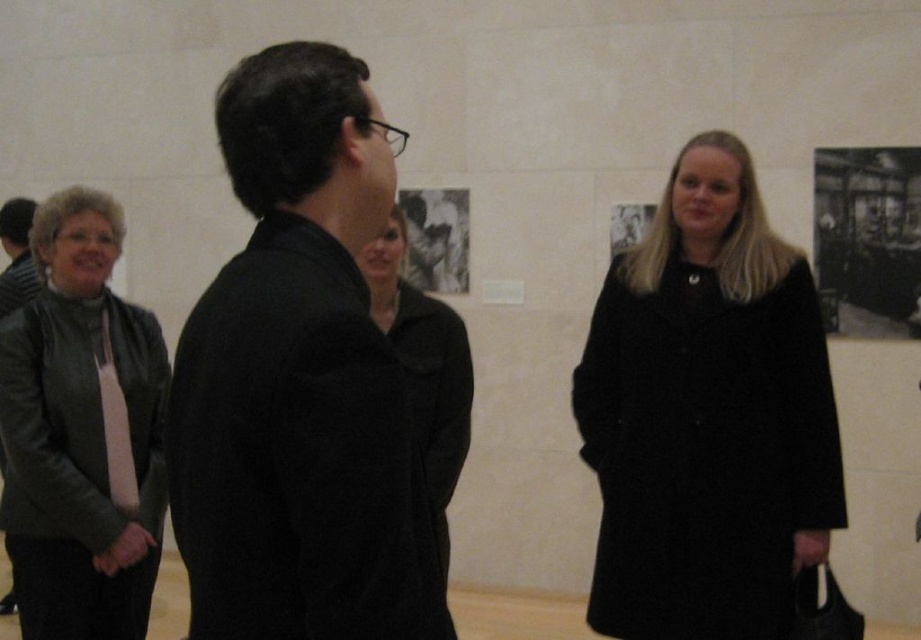
Question: Does leather jacket at left have a smaller size compared to matte black coat at center?

Choices:
 (A) yes
 (B) no

Answer: (B)

Question: Which point is closer to the camera?

Choices:
 (A) (633, 490)
 (B) (302, 392)
 (C) (102, 371)

Answer: (B)

Question: Is black wool coat at right closer to camera compared to matte black coat at center?

Choices:
 (A) no
 (B) yes

Answer: (A)

Question: Among these points, which one is farthest from the camera?

Choices:
 (A) (794, 483)
 (B) (80, 252)
 (C) (458, 332)
 (D) (344, 394)

Answer: (C)

Question: Is black wool coat at right closer to camera compared to matte black coat at center?

Choices:
 (A) yes
 (B) no

Answer: (B)

Question: Which point is closer to the camera?

Choices:
 (A) (328, 637)
 (B) (414, 308)
 (C) (10, 372)

Answer: (A)